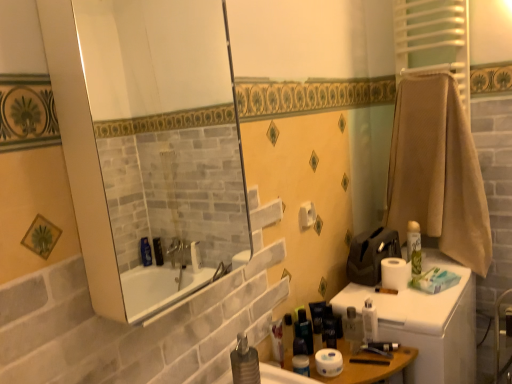
Question: Considering the relative sizes of matte black toiletry at lower center, placed as the third toiletry when sorted from left to right, and green matte spray can at right, the 7th toiletry viewed from the left, in the image provided, is matte black toiletry at lower center, placed as the third toiletry when sorted from left to right, bigger than green matte spray can at right, the 7th toiletry viewed from the left,?

Choices:
 (A) no
 (B) yes

Answer: (A)

Question: Is the surface of matte black toiletry at lower center, which ranks as the fifth toiletry in right-to-left order, in direct contact with green matte spray can at right, which is the first toiletry from right to left?

Choices:
 (A) yes
 (B) no

Answer: (B)

Question: Does matte black toiletry at lower center, placed as the third toiletry when sorted from left to right, have a lesser height compared to green matte spray can at right, the 7th toiletry viewed from the left?

Choices:
 (A) yes
 (B) no

Answer: (A)

Question: From the image's perspective, is matte black toiletry at lower center, which ranks as the fifth toiletry in right-to-left order, located above green matte spray can at right, which is the first toiletry from right to left?

Choices:
 (A) yes
 (B) no

Answer: (B)

Question: Is the position of matte black toiletry at lower center, which ranks as the fifth toiletry in right-to-left order, less distant than that of green matte spray can at right, the 7th toiletry viewed from the left?

Choices:
 (A) yes
 (B) no

Answer: (A)

Question: Is green matte spray can at right, which is the first toiletry from right to left, inside or outside of translucent plastic bottle at lower center, placed as the seventh toiletry when sorted from right to left?

Choices:
 (A) inside
 (B) outside

Answer: (B)

Question: Is point (412, 253) closer or farther from the camera than point (273, 334)?

Choices:
 (A) farther
 (B) closer

Answer: (A)

Question: Considering the positions of green matte spray can at right, which is the first toiletry from right to left, and translucent plastic bottle at lower center, which is the first toiletry in left-to-right order, in the image, is green matte spray can at right, which is the first toiletry from right to left, taller or shorter than translucent plastic bottle at lower center, which is the first toiletry in left-to-right order,?

Choices:
 (A) tall
 (B) short

Answer: (A)

Question: Is green matte spray can at right, which is the first toiletry from right to left, bigger or smaller than translucent plastic bottle at lower center, placed as the seventh toiletry when sorted from right to left?

Choices:
 (A) big
 (B) small

Answer: (A)

Question: From a real-world perspective, is white matte toilet paper at upper center, placed as the 3th toilet paper when sorted from bottom to top, physically located above or below matte black container at lower center, which is counted as the 4th toiletry, starting from the left?

Choices:
 (A) above
 (B) below

Answer: (A)

Question: In the image, is white matte toilet paper at upper center, which is the second toilet paper in front-to-back order, on the left side or the right side of matte black container at lower center, which is counted as the 4th toiletry, starting from the left?

Choices:
 (A) left
 (B) right

Answer: (A)

Question: Is white matte toilet paper at upper center, which is counted as the 1th toilet paper, starting from the left, situated inside matte black container at lower center, arranged as the 4th toiletry when viewed from the right, or outside?

Choices:
 (A) inside
 (B) outside

Answer: (B)

Question: In terms of size, does white matte toilet paper at upper center, placed as the 3th toilet paper when sorted from bottom to top, appear bigger or smaller than matte black container at lower center, arranged as the 4th toiletry when viewed from the right?

Choices:
 (A) big
 (B) small

Answer: (B)

Question: Considering the positions of point (332, 370) and point (441, 148), is point (332, 370) closer or farther from the camera than point (441, 148)?

Choices:
 (A) closer
 (B) farther

Answer: (A)

Question: Considering their positions, is white matte toilet paper at lower center, positioned as the first toilet paper in front-to-back order, located in front of or behind beige textured towel at right?

Choices:
 (A) behind
 (B) front

Answer: (B)